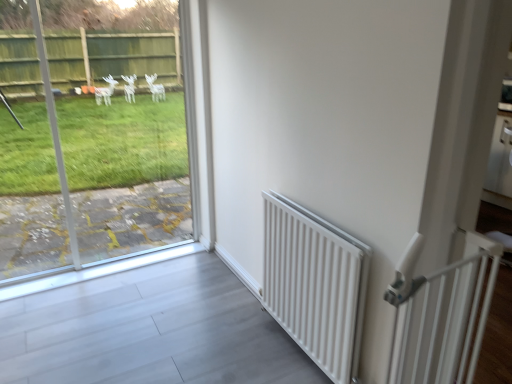
You are a GUI agent. You are given a task and a screenshot of the screen. Output one action in this format:
    pyautogui.click(x=<x>, y=<y>)
    Task: Click on the vacant space underneath white matte radiator at right (from a real-world perspective)
    
    Given the screenshot: What is the action you would take?
    pyautogui.click(x=294, y=349)